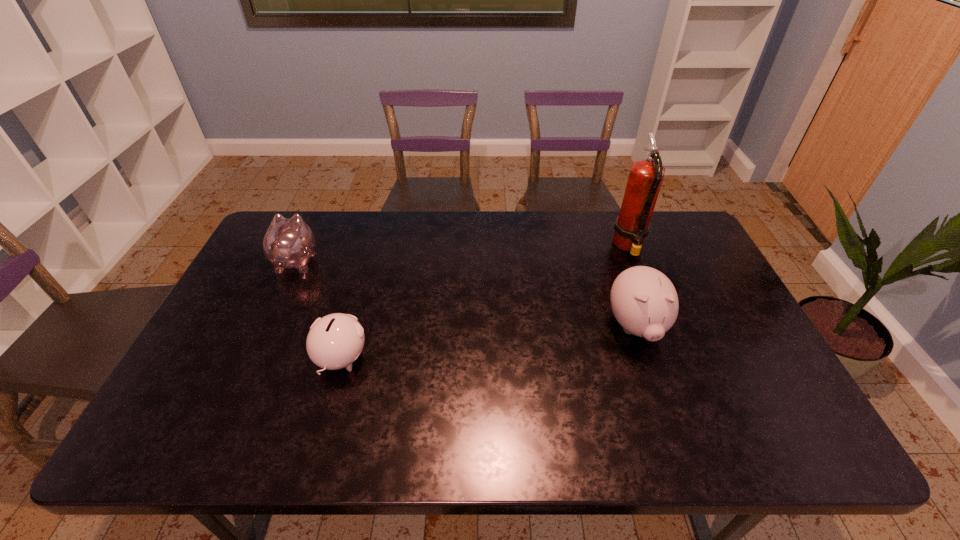
Identify the location of free space at the left edge. (196, 367).

This screenshot has width=960, height=540. I want to click on vacant space at the right edge of the desktop, so click(701, 278).

In the image, there is a desktop. Identify the location of vacant area at the far right corner. (669, 251).

Where is `free space that is in between the leftmost piggy bank and the tallest object`? The height and width of the screenshot is (540, 960). free space that is in between the leftmost piggy bank and the tallest object is located at coordinates (463, 253).

This screenshot has height=540, width=960. I want to click on vacant area that lies between the farthest piggy bank and the shortest piggy bank, so click(319, 310).

Locate an element on the screen. Image resolution: width=960 pixels, height=540 pixels. vacant point located between the farthest piggy bank and the fire extinguisher is located at coordinates (463, 253).

The height and width of the screenshot is (540, 960). I want to click on free point between the second piggy bank from right to left and the rightmost piggy bank, so click(x=489, y=343).

The width and height of the screenshot is (960, 540). I want to click on free spot between the rightmost piggy bank and the leftmost object, so click(x=467, y=294).

You are a GUI agent. You are given a task and a screenshot of the screen. Output one action in this format:
    pyautogui.click(x=<x>, y=<y>)
    Task: Click on the free space between the third object from right to left and the tallest object
    
    Given the screenshot: What is the action you would take?
    pyautogui.click(x=485, y=303)

Where is `free space between the rightmost piggy bank and the farthest piggy bank`? free space between the rightmost piggy bank and the farthest piggy bank is located at coordinates (467, 294).